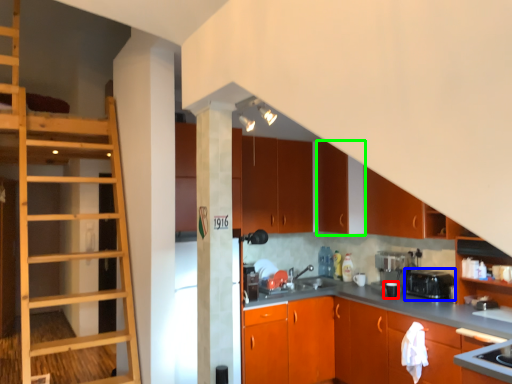
Question: Considering the real-world distances, which object is farthest from appliance (highlighted by a red box)? appliance (highlighted by a blue box) or cabinetry (highlighted by a green box)?

Choices:
 (A) appliance
 (B) cabinetry

Answer: (B)